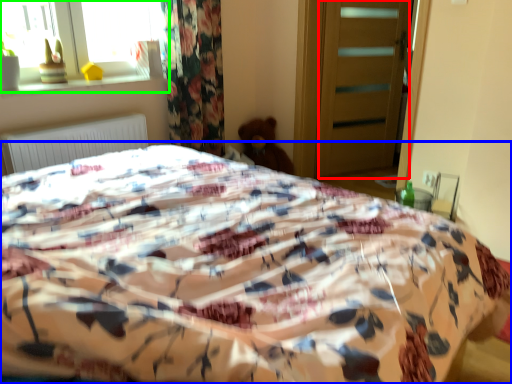
Question: Considering the real-world distances, which object is farthest from screen door (highlighted by a red box)? bed (highlighted by a blue box) or window (highlighted by a green box)?

Choices:
 (A) bed
 (B) window

Answer: (A)